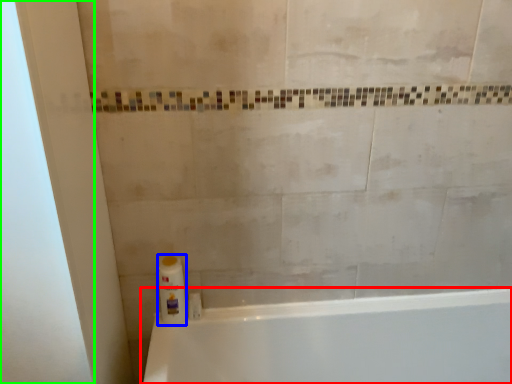
Question: Which object is positioned closest to bathtub (highlighted by a red box)? Select from cleaning product (highlighted by a blue box) and screen door (highlighted by a green box).

Choices:
 (A) cleaning product
 (B) screen door

Answer: (A)